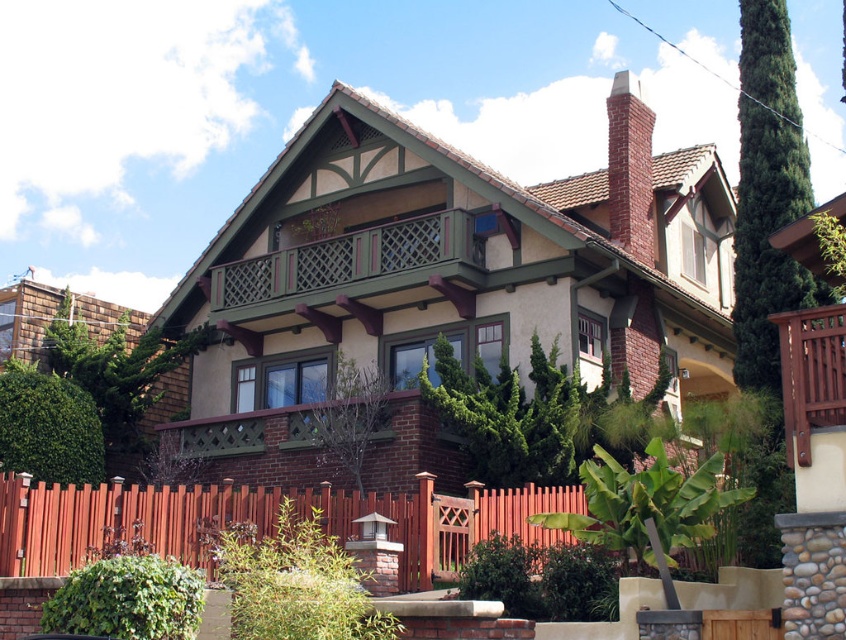
Question: Which point is farther from the camera taking this photo?

Choices:
 (A) (636, 93)
 (B) (569, 508)
 (C) (262, 444)
 (D) (801, 387)

Answer: (A)

Question: Does green wood balcony at upper center have a larger size compared to red brick chimney at upper right?

Choices:
 (A) yes
 (B) no

Answer: (B)

Question: Considering the relative positions of brown wood fence at lower center and green wood lattice balcony at center in the image provided, where is brown wood fence at lower center located with respect to green wood lattice balcony at center?

Choices:
 (A) right
 (B) left

Answer: (A)

Question: Which point is farther from the camera taking this photo?

Choices:
 (A) (784, 339)
 (B) (248, 321)
 (C) (305, 440)
 (D) (338, 509)

Answer: (B)

Question: Is brown wood fence at lower center above green wood balcony at upper center?

Choices:
 (A) no
 (B) yes

Answer: (A)

Question: Which point is closer to the camera?

Choices:
 (A) (627, 129)
 (B) (356, 236)

Answer: (B)